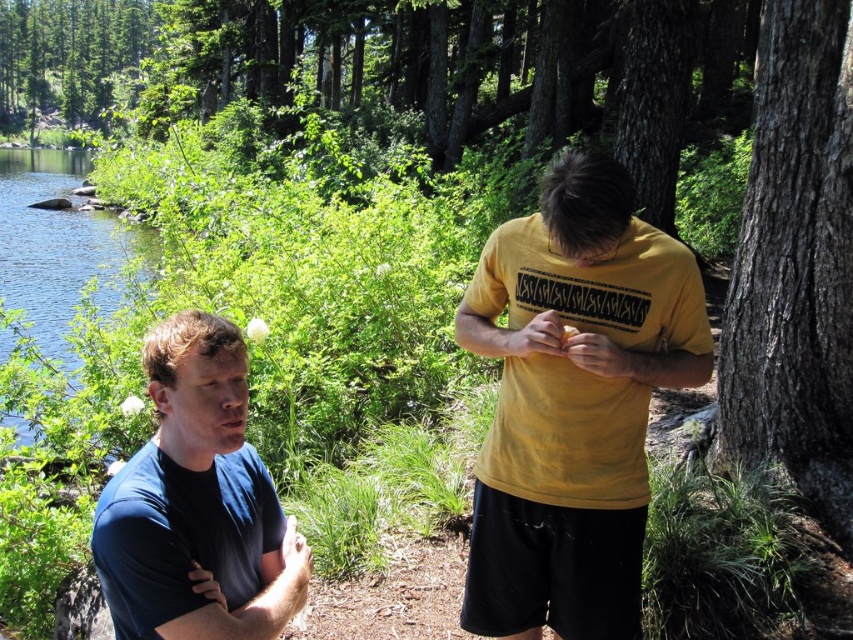
Question: Which of these objects is positioned closest to the blue cotton shirt at lower left?

Choices:
 (A) smooth bark tree at right
 (B) blue water at left
 (C) yellow matte shirt at right

Answer: (C)

Question: Observing the image, what is the correct spatial positioning of blue cotton shirt at lower left in reference to blue water at left?

Choices:
 (A) right
 (B) left

Answer: (A)

Question: Is yellow matte shirt at right thinner than blue water at left?

Choices:
 (A) no
 (B) yes

Answer: (B)

Question: Among these points, which one is farthest from the camera?

Choices:
 (A) (3, 228)
 (B) (576, 608)
 (C) (134, 509)

Answer: (A)

Question: Which of these objects is positioned closest to the yellow matte shirt at right?

Choices:
 (A) blue cotton shirt at lower left
 (B) smooth bark tree at right
 (C) blue water at left

Answer: (A)

Question: In this image, where is yellow matte shirt at right located relative to smooth bark tree at right?

Choices:
 (A) left
 (B) right

Answer: (A)